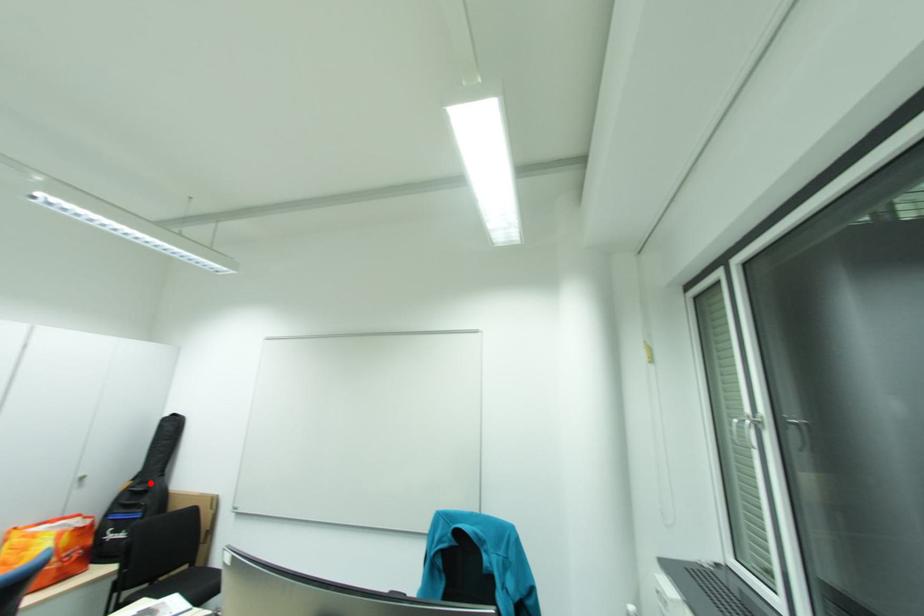
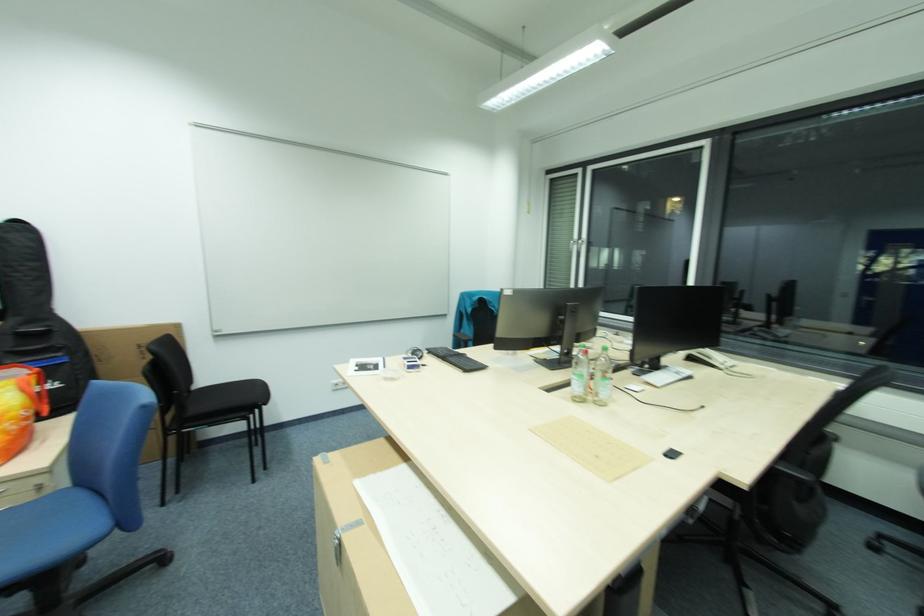
In the second image, find the point that corresponds to the highlighted location in the first image.

(41, 322)